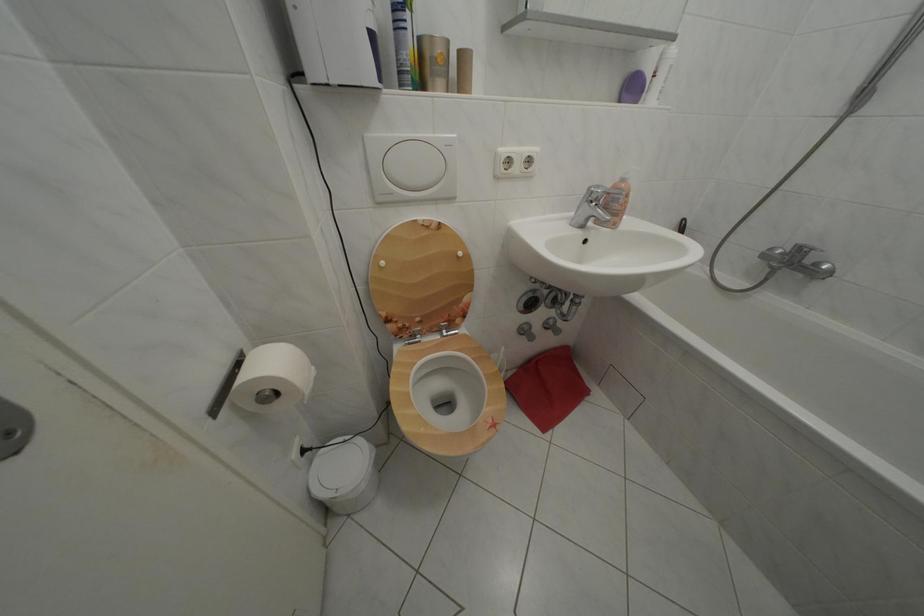
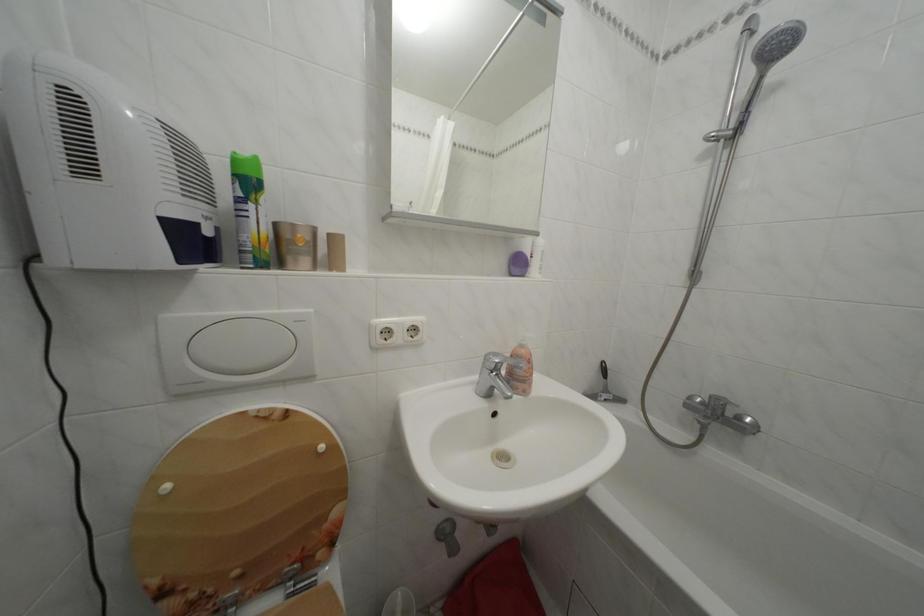
What movement of the cameraman would produce the second image?

The cameraman moved toward right, forward.